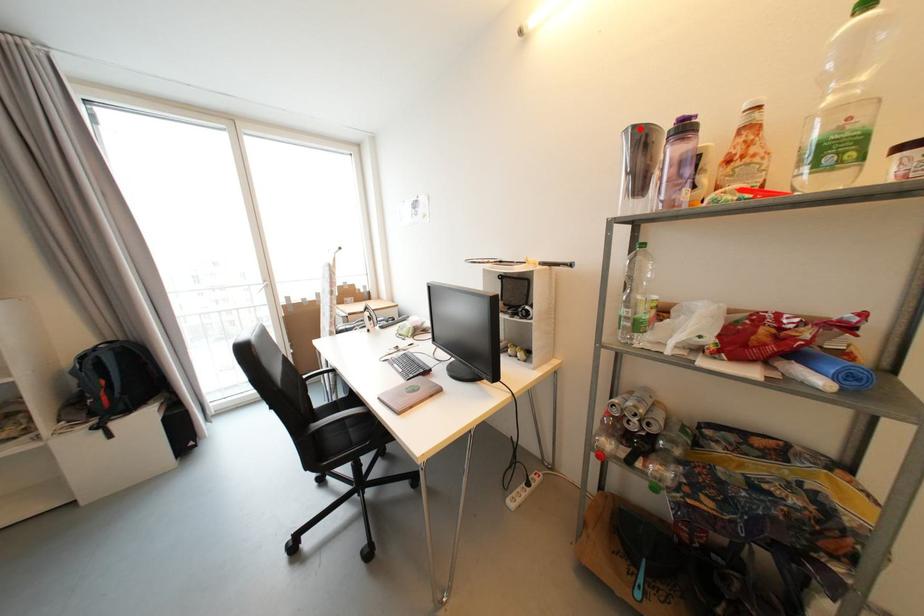
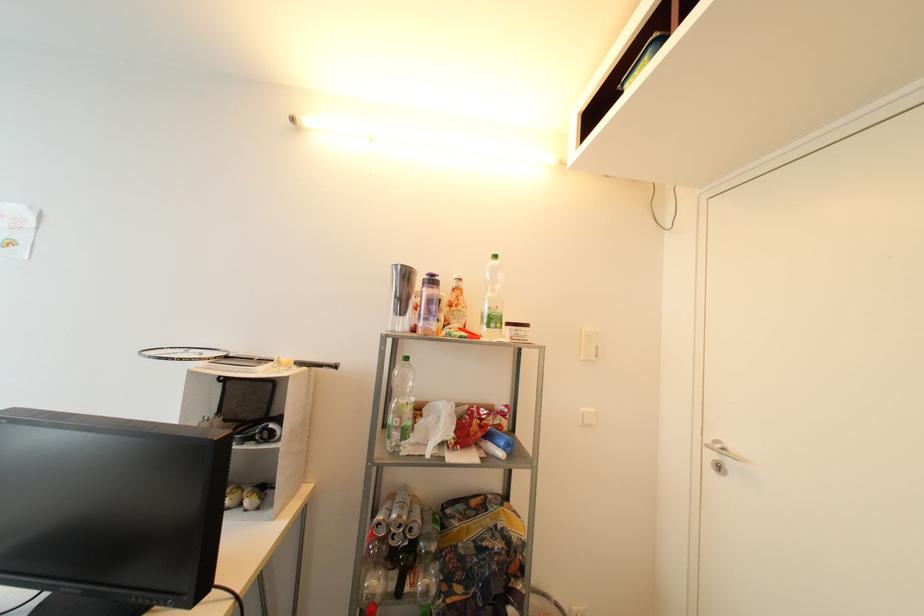
The point at the highlighted location is marked in the first image. Where is the corresponding point in the second image?

(407, 268)